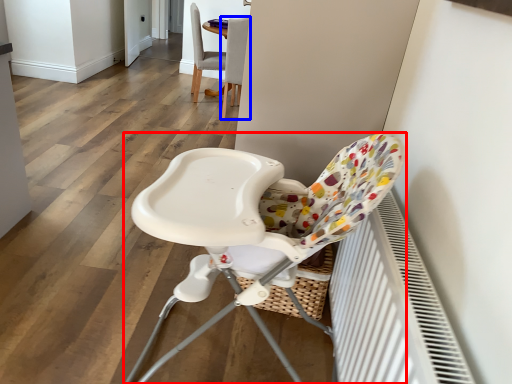
Question: Which object is further to the camera taking this photo, chair (highlighted by a red box) or chair (highlighted by a blue box)?

Choices:
 (A) chair
 (B) chair

Answer: (B)